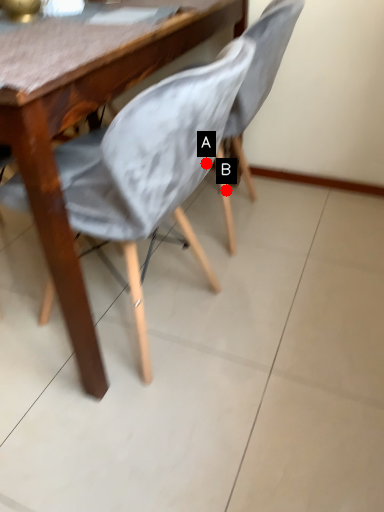
Question: Two points are circled on the image, labeled by A and B beside each circle. Which point is closer to the camera?

Choices:
 (A) A is closer
 (B) B is closer

Answer: (A)